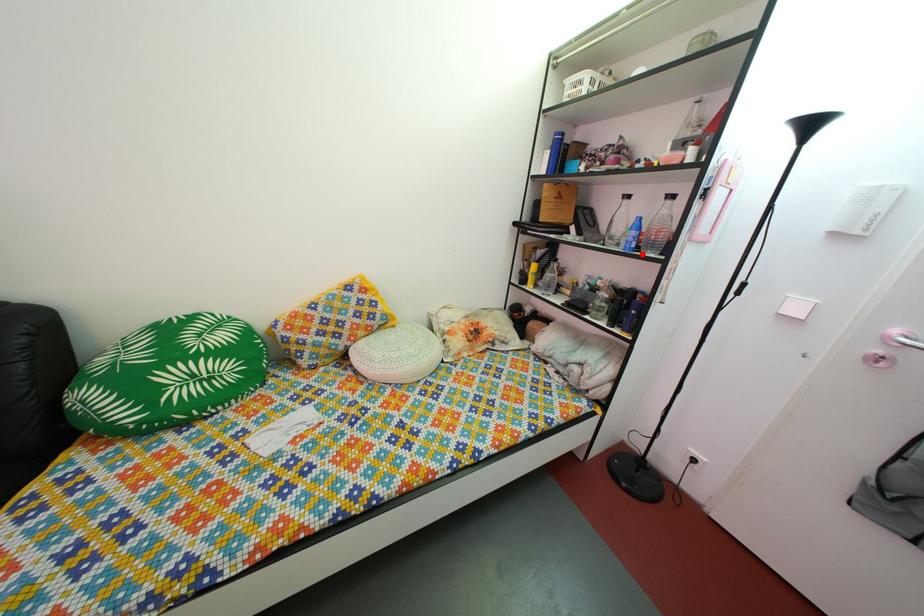
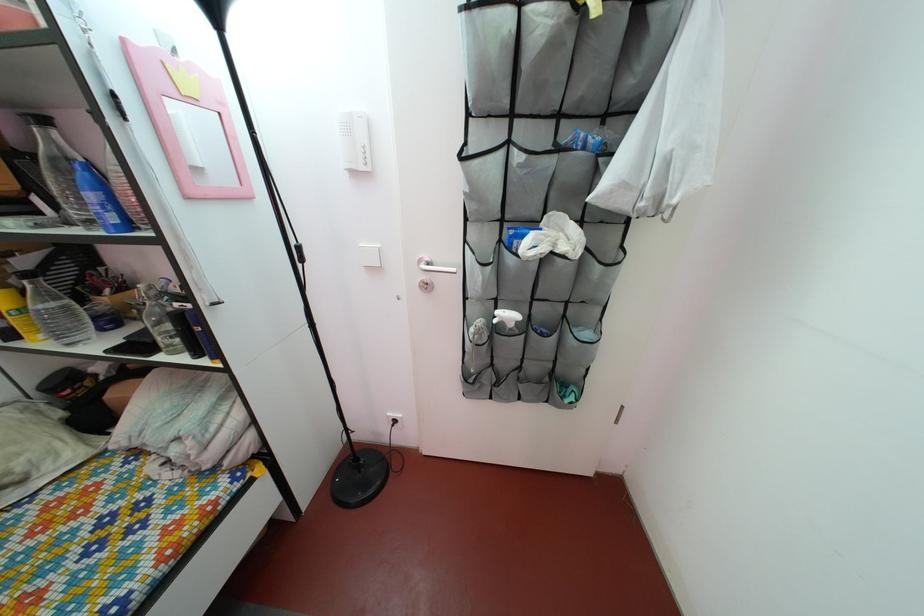
Find the pixel in the second image that matches the highlighted location in the first image.

(124, 229)